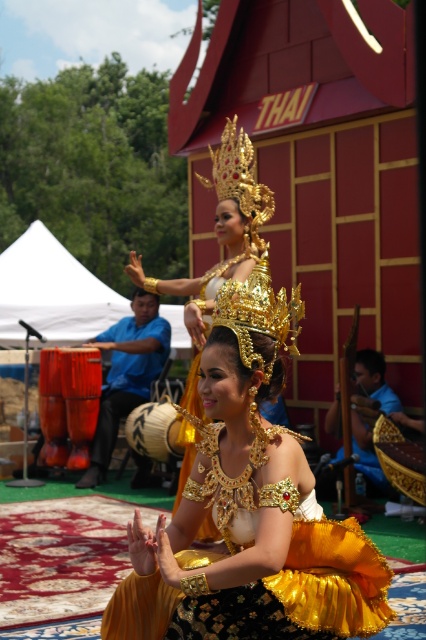
You are a photographer at the event and want to capture both the golden silk dress at center and the gold metallic headdress at center in a single frame. Given that the camera has a limited zoom range, which object should you focus on to ensure both are in the frame without cropping?

Since the golden silk dress at center is smaller than the gold metallic headdress at center, you should focus on the gold metallic headdress at center to ensure both objects fit within the frame.

You are a photographer at the event and want to capture a closeup of the golden silk dress at center and the gold metallic headdress at center. Which one will appear larger in your photo?

The golden silk dress at center will appear larger in the photo because it is closer to the viewer than the gold metallic headdress at center.

You are a photographer at the event and want to capture the golden silk dress at center in your photo. The camera you are using has a rectangular frame with a width of 1.0 and height of 0.7. The frame is positioned such that its center is at point [250,509]. Will the entire golden silk dress at center fit within the camera frame?

The point [250,509] corresponds to the golden silk dress at center. Since the camera frame is centered at this point and has a width of 1.0 and height of 0.7, the golden silk dress at center will be centered within the frame. However, without knowing the size of the golden silk dress at center relative to the frame dimensions, it is impossible to determine if it will fit entirely within the frame.